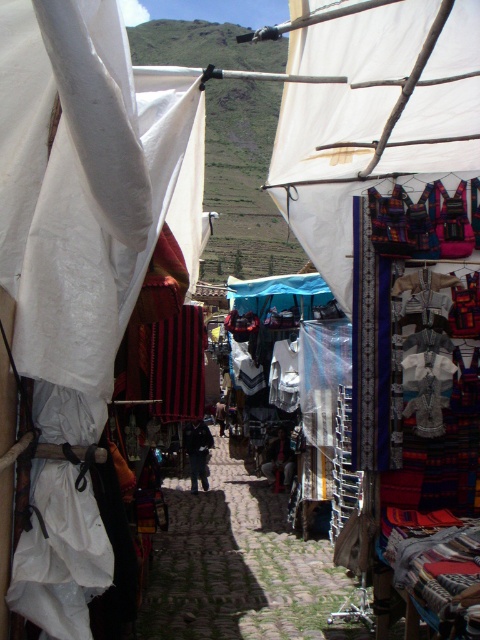
Question: Is white fabric canopy at upper center positioned in front of cobblestone alley at center?

Choices:
 (A) yes
 (B) no

Answer: (A)

Question: Which point is closer to the camera taking this photo?

Choices:
 (A) (439, 156)
 (B) (212, 490)

Answer: (A)

Question: Observing the image, what is the correct spatial positioning of white fabric canopy at upper center in reference to cobblestone alley at center?

Choices:
 (A) right
 (B) left

Answer: (A)

Question: Can you confirm if white fabric canopy at upper center is thinner than cobblestone alley at center?

Choices:
 (A) yes
 (B) no

Answer: (A)